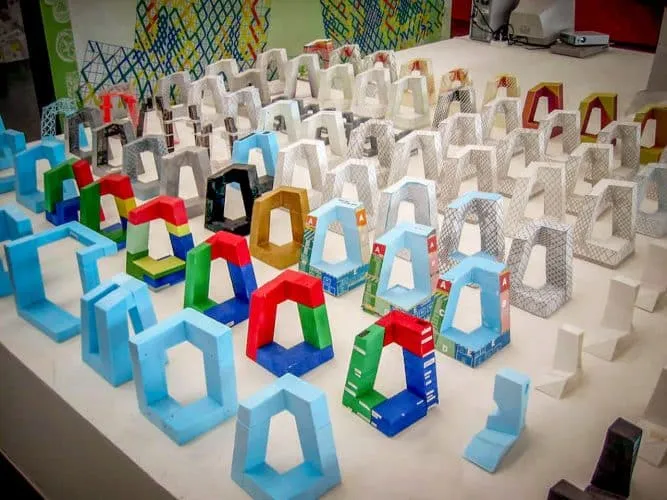
Locate an element on the screen. The width and height of the screenshot is (667, 500). computer wires is located at coordinates (504, 29), (528, 38).